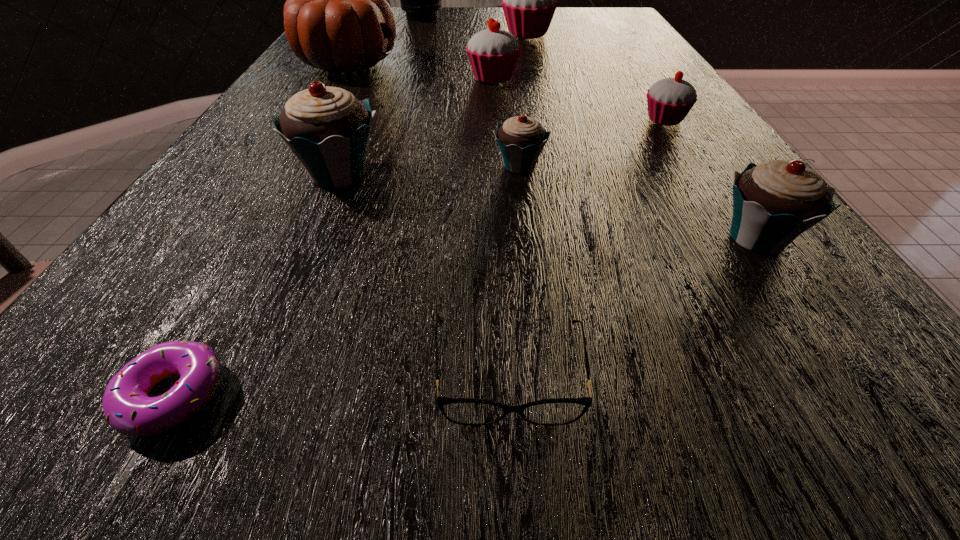
The width and height of the screenshot is (960, 540). In order to click on pumpkin situated at the left edge in this screenshot , I will do `click(336, 18)`.

Locate an element on the screen. cupcake situated at the left edge is located at coordinates (328, 129).

Find the location of `doughnut located in the left edge section of the desktop`. doughnut located in the left edge section of the desktop is located at coordinates (127, 408).

Identify the location of object that is at the near left corner. Image resolution: width=960 pixels, height=540 pixels. (127, 408).

You are a GUI agent. You are given a task and a screenshot of the screen. Output one action in this format:
    pyautogui.click(x=<x>, y=<y>)
    Task: Click on the free spot at the far edge of the desktop
    The height and width of the screenshot is (540, 960).
    Given the screenshot: What is the action you would take?
    pyautogui.click(x=474, y=29)

Find the location of a particular element. This screenshot has width=960, height=540. vacant point at the near edge is located at coordinates (544, 482).

Locate an element on the screen. vacant space at the left edge is located at coordinates (294, 81).

The image size is (960, 540). Find the location of `free space at the right edge`. free space at the right edge is located at coordinates (655, 59).

You are a GUI agent. You are given a task and a screenshot of the screen. Output one action in this format:
    pyautogui.click(x=<x>, y=<y>)
    Task: Click on the vacant space at the far right corner
    The image size is (960, 540).
    Given the screenshot: What is the action you would take?
    pyautogui.click(x=612, y=16)

The height and width of the screenshot is (540, 960). What are the coordinates of `free space between the third farthest cupcake and the telephoto lens` in the screenshot? It's located at (543, 68).